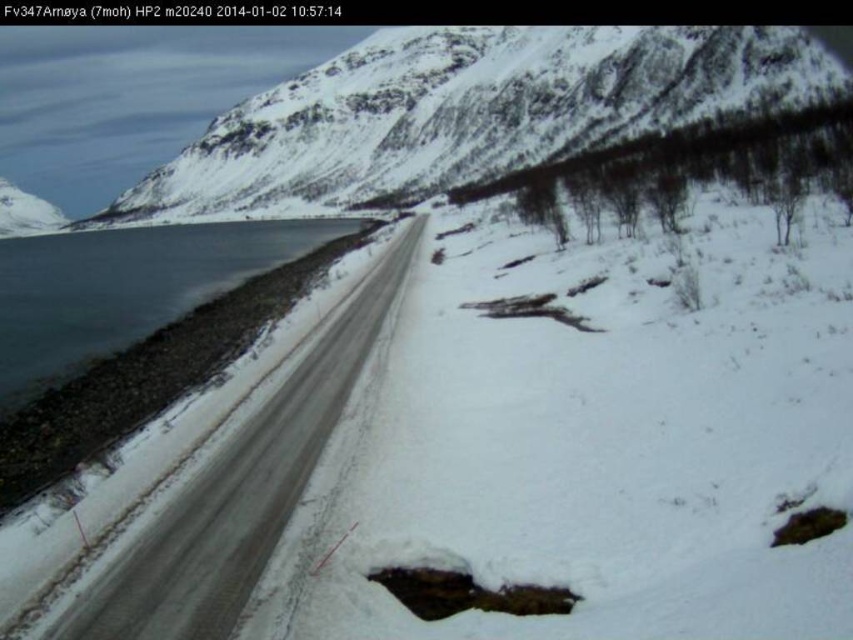
Between snowy rock at upper center and snowy asphalt road at left, which one has more height?

With more height is snowy rock at upper center.

Between snowy rock at upper center and snowy asphalt road at left, which one appears on the right side from the viewer's perspective?

snowy rock at upper center is more to the right.

You are a GUI agent. You are given a task and a screenshot of the screen. Output one action in this format:
    pyautogui.click(x=<x>, y=<y>)
    Task: Click on the snowy rock at upper center
    The image size is (853, 640).
    Given the screenshot: What is the action you would take?
    pyautogui.click(x=473, y=112)